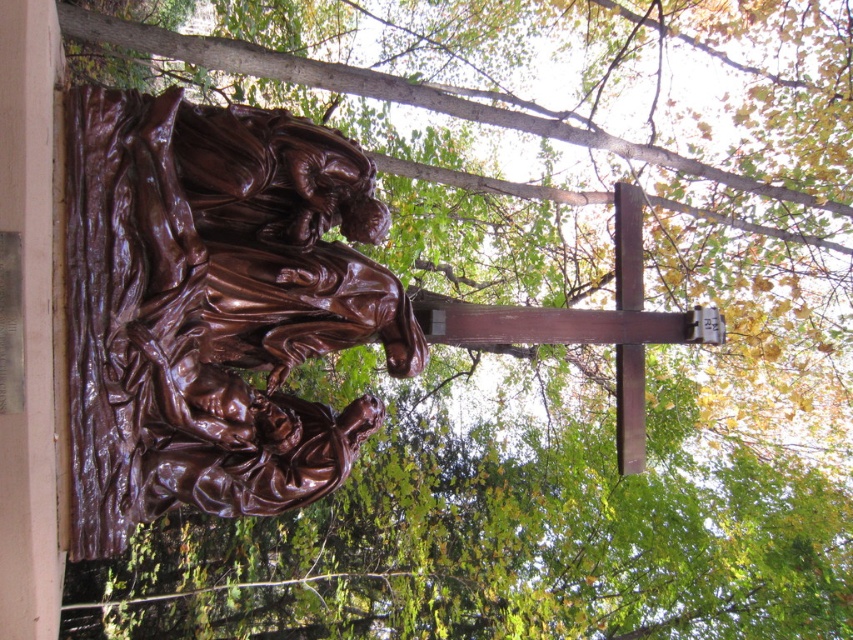
Question: Among these objects, which one is farthest from the camera?

Choices:
 (A) wooden cross at upper center
 (B) bronze sculpture at center

Answer: (A)

Question: Is bronze sculpture at center to the right of wooden cross at upper center from the viewer's perspective?

Choices:
 (A) yes
 (B) no

Answer: (B)

Question: Is bronze sculpture at center smaller than wooden cross at upper center?

Choices:
 (A) no
 (B) yes

Answer: (B)

Question: Is bronze sculpture at center further to the viewer compared to wooden cross at upper center?

Choices:
 (A) no
 (B) yes

Answer: (A)